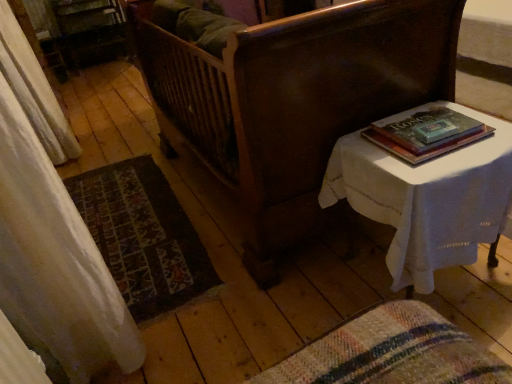
This screenshot has height=384, width=512. Describe the element at coordinates (143, 236) in the screenshot. I see `carpeted mat at lower left` at that location.

Describe the element at coordinates (34, 90) in the screenshot. I see `white sheer curtain at left` at that location.

Identify the location of hardcover book at upper right. The height and width of the screenshot is (384, 512). (426, 134).

Does hardcover book at upper right lie in front of white sheer curtain at left?

Yes, the depth of hardcover book at upper right is less than that of white sheer curtain at left.

From the image's perspective, which is below, hardcover book at upper right or white sheer curtain at left?

hardcover book at upper right is shown below in the image.

Between hardcover book at upper right and white sheer curtain at left, which one has smaller width?

white sheer curtain at left.

Does hardcover book at upper right have a smaller size compared to white sheer curtain at left?

Yes, hardcover book at upper right is smaller than white sheer curtain at left.

Considering the points (415, 160) and (372, 156), which point is behind, point (415, 160) or point (372, 156)?

The point (372, 156) is farther from the camera.

Based on the photo, considering the relative sizes of hardcover book at upper right and white cloth-covered table at right in the image provided, is hardcover book at upper right thinner than white cloth-covered table at right?

Yes, hardcover book at upper right is thinner than white cloth-covered table at right.

Are hardcover book at upper right and white cloth-covered table at right far apart?

No, hardcover book at upper right is not far away from white cloth-covered table at right.

Can you confirm if hardcover book at upper right is taller than white cloth-covered table at right?

No, hardcover book at upper right is not taller than white cloth-covered table at right.

From the image's perspective, relative to hardcover book at upper right, is white sheer curtain at left above or below?

Clearly, from the image's perspective, white sheer curtain at left is above hardcover book at upper right.

Is white sheer curtain at left wider than hardcover book at upper right?

No.

Is point (22, 57) in front of point (428, 109)?

No.

Between dark wood bed at center and white cloth-covered table at right, which one has less height?

white cloth-covered table at right.

How many degrees apart are the facing directions of dark wood bed at center and white cloth-covered table at right?

They differ by 2.9 degrees in their facing directions.

Identify the location of table behind the dark wood bed at center. (426, 197).

Are dark wood bed at center and white cloth-covered table at right far apart?

That's not correct — dark wood bed at center is a little close to white cloth-covered table at right.

Which object is more forward, white sheer curtain at left or dark wood bed at center?

dark wood bed at center is closer to the camera.

Does point (44, 148) lie in front of point (158, 33)?

No, it is not.

Between white sheer curtain at left and dark wood bed at center, which one has smaller size?

With smaller size is white sheer curtain at left.

Is white sheer curtain at left shorter than dark wood bed at center?

In fact, white sheer curtain at left may be taller than dark wood bed at center.

Could dark wood bed at center be considered to be inside carpeted mat at lower left?

No, dark wood bed at center is not surrounded by carpeted mat at lower left.

This screenshot has height=384, width=512. I want to click on furniture that appears above the carpeted mat at lower left (from the image's perspective), so click(x=295, y=100).

Considering the sizes of objects carpeted mat at lower left and dark wood bed at center in the image provided, who is taller, carpeted mat at lower left or dark wood bed at center?

Standing taller between the two is dark wood bed at center.

Is white cloth-covered table at right at the left side of dark wood bed at center?

No, white cloth-covered table at right is not to the left of dark wood bed at center.

Consider the image. Which of these two, white cloth-covered table at right or dark wood bed at center, is wider?

Wider between the two is dark wood bed at center.

Can you tell me how much white cloth-covered table at right and dark wood bed at center differ in facing direction?

The angle between the facing direction of white cloth-covered table at right and the facing direction of dark wood bed at center is 2.9 degrees.

From the image's perspective, is white cloth-covered table at right above or below dark wood bed at center?

Clearly, from the image's perspective, white cloth-covered table at right is below dark wood bed at center.

The width and height of the screenshot is (512, 384). Identify the location of book positioned vertically above the white sheer curtain at left (from a real-world perspective). (426, 134).

Where is `table below the hardcover book at upper right (from the image's perspective)`? The height and width of the screenshot is (384, 512). table below the hardcover book at upper right (from the image's perspective) is located at coordinates (426, 197).

Based on their spatial positions, is carpeted mat at lower left or white cloth-covered table at right closer to white sheer curtain at left?

The object closer to white sheer curtain at left is carpeted mat at lower left.

Estimate the real-world distances between objects in this image. Which object is further from white sheer curtain at left, dark wood bed at center or hardcover book at upper right?

hardcover book at upper right is positioned further to the anchor white sheer curtain at left.

Considering their positions, is carpeted mat at lower left positioned further to white cloth-covered table at right than white sheer curtain at left?

Based on the image, white sheer curtain at left appears to be further to white cloth-covered table at right.

Based on their spatial positions, is dark wood bed at center or white cloth-covered table at right closer to white sheer curtain at left?

dark wood bed at center.

Looking at the image, which one is located further to carpeted mat at lower left, white sheer curtain at left or hardcover book at upper right?

Among the two, hardcover book at upper right is located further to carpeted mat at lower left.

Considering their positions, is dark wood bed at center positioned further to hardcover book at upper right than white cloth-covered table at right?

Based on the image, dark wood bed at center appears to be further to hardcover book at upper right.

Considering their positions, is carpeted mat at lower left positioned further to dark wood bed at center than white sheer curtain at left?

white sheer curtain at left.

Consider the image. Which object lies nearer to the anchor point carpeted mat at lower left, white sheer curtain at left or white cloth-covered table at right?

white sheer curtain at left.

Where is `furniture between white sheer curtain at left and hardcover book at upper right from left to right`? furniture between white sheer curtain at left and hardcover book at upper right from left to right is located at coordinates (295, 100).

This screenshot has height=384, width=512. I want to click on mat located between white sheer curtain at left and hardcover book at upper right in the left-right direction, so click(143, 236).

The image size is (512, 384). In order to click on furniture situated between carpeted mat at lower left and white cloth-covered table at right from left to right in this screenshot , I will do `click(295, 100)`.

The image size is (512, 384). What are the coordinates of `book between white sheer curtain at left and white cloth-covered table at right from left to right` in the screenshot? It's located at click(x=426, y=134).